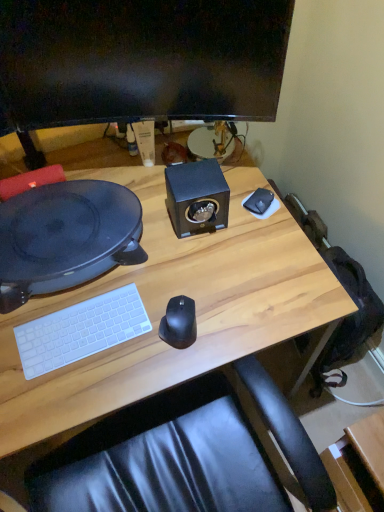
Locate an element on the screen. The width and height of the screenshot is (384, 512). vacant area situated below white matte keyboard at lower left (from a real-world perspective) is located at coordinates (84, 332).